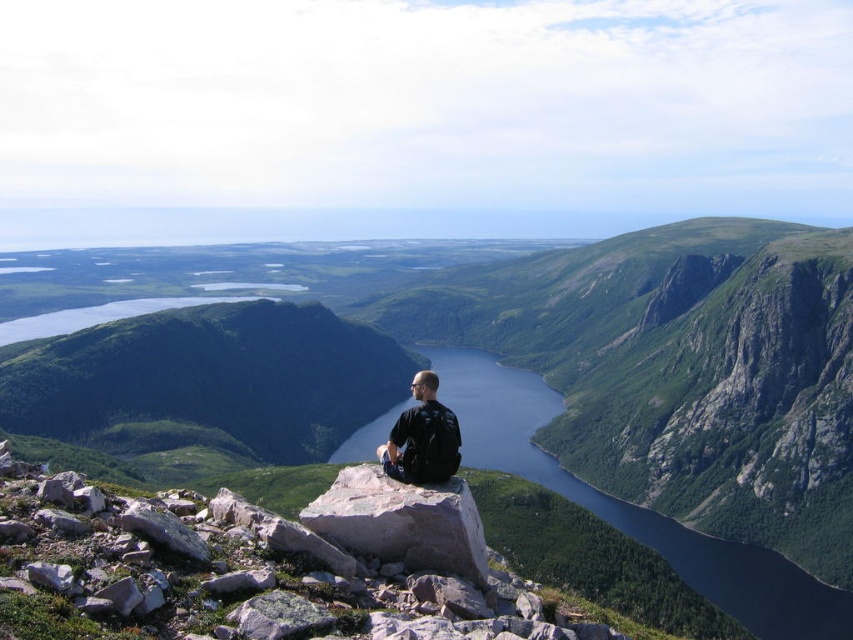
You are standing on the rocky outcrop and want to point out both the blue glassy water at center and the black fabric backpack at center to a friend. Which object is located to the right of the other?

The blue glassy water at center is to the right of the black fabric backpack at center.

You are standing at the edge of the valley and want to reach the point marked at coordinates point (x=793, y=282). If your walking speed is 3 feet per second, how many seconds will it take you to reach that point?

The point marked at coordinates point (x=793, y=282) is 750.94 feet away from the viewer. At a walking speed of 3 feet per second, it would take approximately 250.31 seconds to reach that point.

You are planning to set up a campsite and have two options for locations. The first is on the green rocky mountain at center, and the second is on the gray rock at center. Based on the size of these features, which location would provide more space for setting up tents and equipment?

The green rocky mountain at center might be wider than gray rock at center, so it would likely provide more space for setting up tents and equipment.